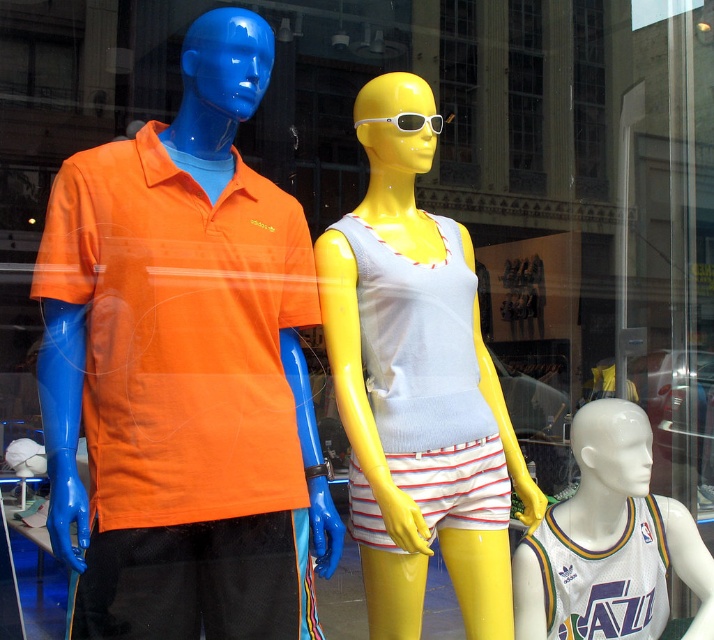
Question: Which of the following is the closest to the observer?

Choices:
 (A) matte yellow mannequin at center
 (B) white plastic sunglasses at center

Answer: (A)

Question: Estimate the real-world distances between objects in this image. Which object is closer to the matte yellow mannequin at center?

Choices:
 (A) white jersey at lower right
 (B) white plastic sunglasses at center
 (C) matte orange polo shirt at left

Answer: (C)

Question: Considering the relative positions of white jersey at lower right and white plastic sunglasses at center in the image provided, where is white jersey at lower right located with respect to white plastic sunglasses at center?

Choices:
 (A) left
 (B) right

Answer: (B)

Question: Estimate the real-world distances between objects in this image. Which object is closer to the white plastic sunglasses at center?

Choices:
 (A) matte orange polo shirt at left
 (B) matte yellow mannequin at center
 (C) white jersey at lower right

Answer: (B)

Question: Can you confirm if matte orange polo shirt at left is positioned to the right of white plastic sunglasses at center?

Choices:
 (A) no
 (B) yes

Answer: (A)

Question: Is matte orange polo shirt at left behind white jersey at lower right?

Choices:
 (A) yes
 (B) no

Answer: (B)